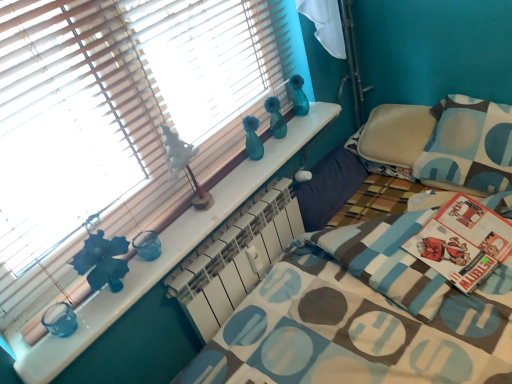
You are a GUI agent. You are given a task and a screenshot of the screen. Output one action in this format:
    pyautogui.click(x=<x>, y=<y>)
    Task: Click on the free space in front of white matte table lamp at upper center
    
    Given the screenshot: What is the action you would take?
    pyautogui.click(x=195, y=222)